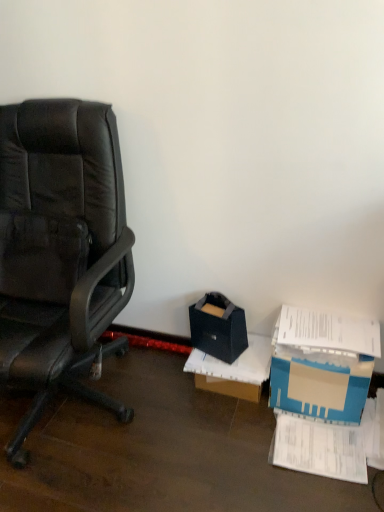
Where is `vacant area on top of blue cardboard box at lower right (from a real-world perspective)`? vacant area on top of blue cardboard box at lower right (from a real-world perspective) is located at coordinates (329, 328).